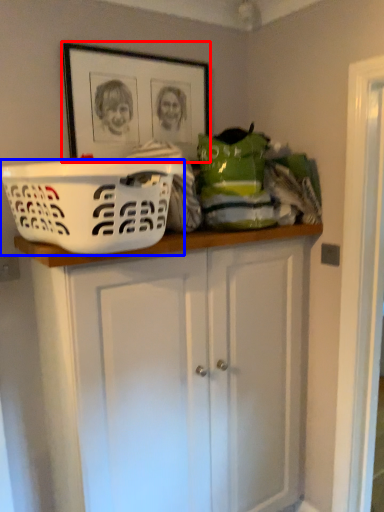
Question: Which of the following is the closest to the observer, picture frame (highlighted by a red box) or basket (highlighted by a blue box)?

Choices:
 (A) picture frame
 (B) basket

Answer: (B)